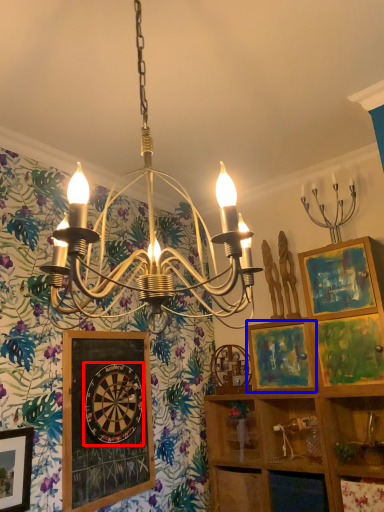
Question: Which point is further to the camera, design (highlighted by a red box) or picture frame (highlighted by a blue box)?

Choices:
 (A) design
 (B) picture frame

Answer: (B)